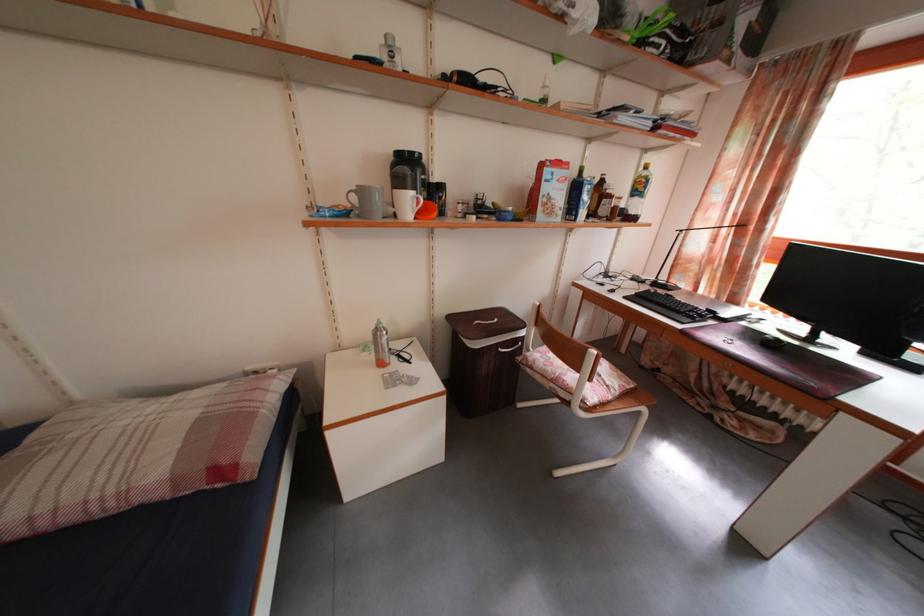
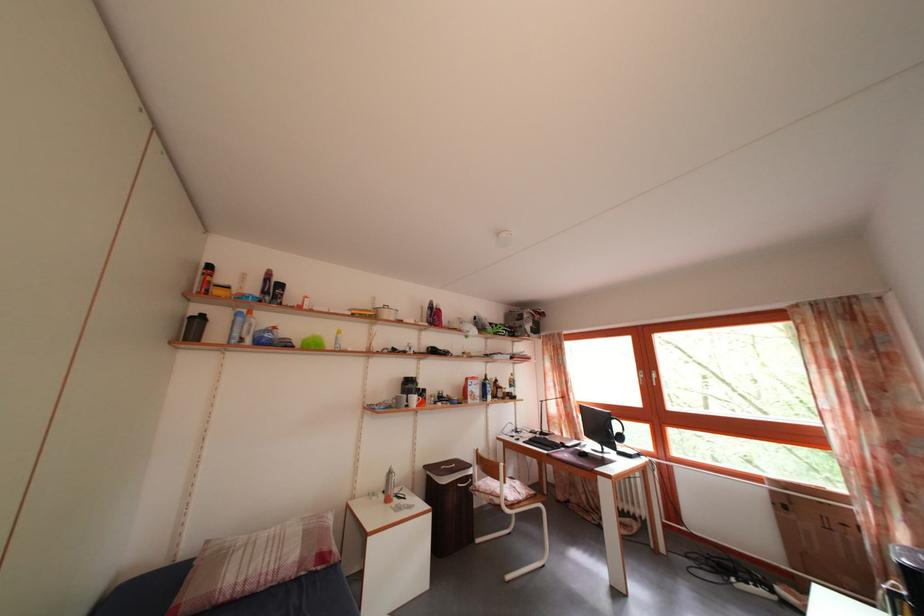
In the second image, find the point that corresponds to point 663,291 in the first image.

(550, 440)